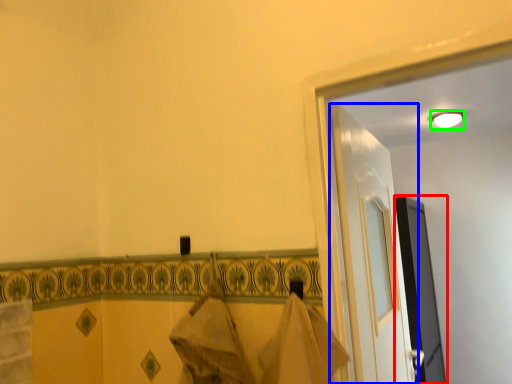
Question: Which is nearer to the screen door (highlighted by a red box)? door (highlighted by a blue box) or light (highlighted by a green box).

Choices:
 (A) door
 (B) light

Answer: (B)